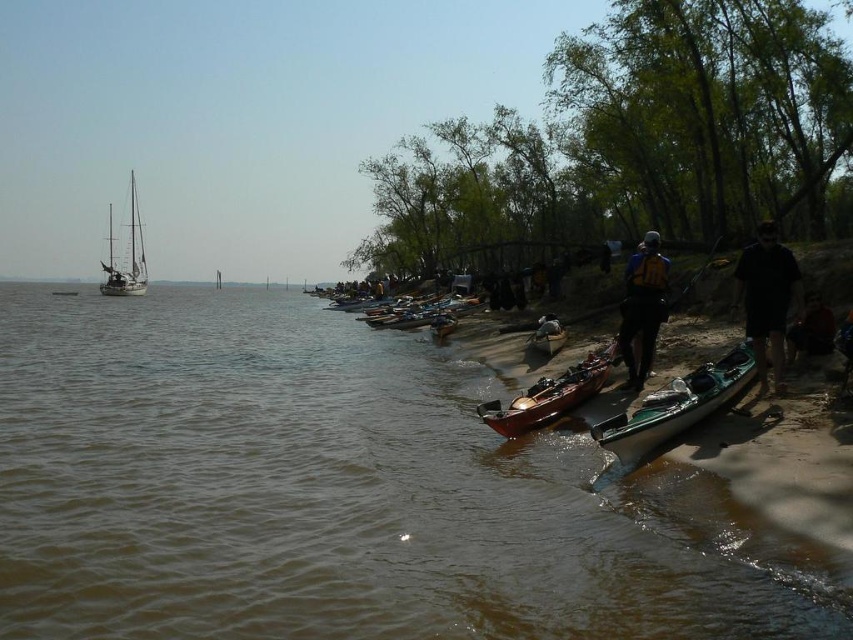
Question: Which point is closer to the camera?

Choices:
 (A) (544, 342)
 (B) (641, 243)
 (C) (558, 404)
 (D) (706, 378)

Answer: (D)

Question: Where is white wooden sailboat at left located in relation to red fabric shirt at lower right in the image?

Choices:
 (A) above
 (B) below

Answer: (A)

Question: Which point is farther to the camera?

Choices:
 (A) (680, 424)
 (B) (556, 346)
 (C) (668, 262)

Answer: (B)

Question: Which is nearer to the matte black kayak at center?

Choices:
 (A) green plastic kayak at lower right
 (B) matte brown canoe at center

Answer: (B)

Question: Considering the relative positions of brown matte water at lower left and yellow life vest at center in the image provided, where is brown matte water at lower left located with respect to yellow life vest at center?

Choices:
 (A) above
 (B) below

Answer: (B)

Question: Does green plastic kayak at lower right appear over red fabric shirt at lower right?

Choices:
 (A) no
 (B) yes

Answer: (A)